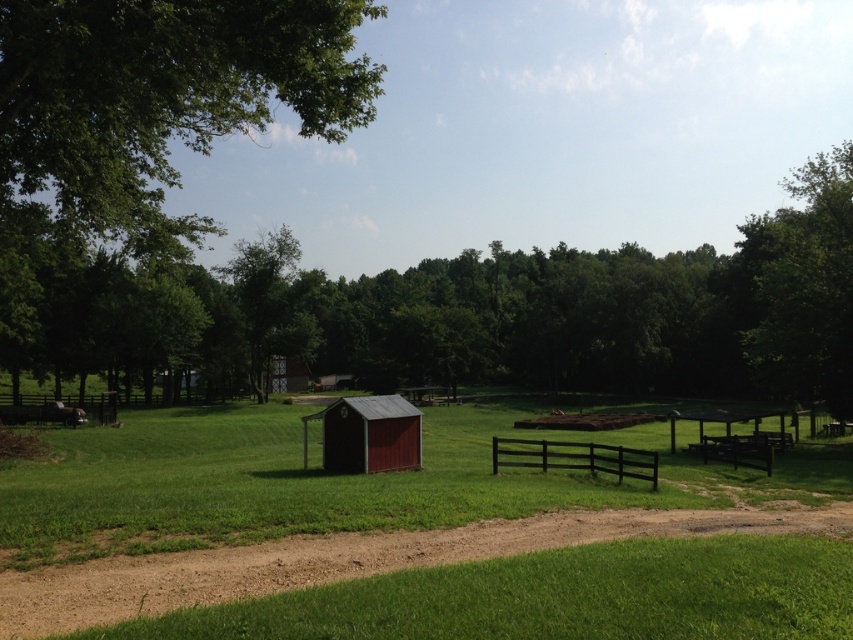
You are a drone operator trying to capture a photo of the black wooden fence at center. You notice the green leafy tree at upper left might block your view. Based on the scene, will the tree obstruct the fence in your photo?

The green leafy tree at upper left is above the black wooden fence at center, so it will block the view of the fence in your photo.

Consider the image. You are a landscape designer planning to add a new garden feature. You see the green leafy tree at upper left and the black wooden fence at center. Which object is bigger in size?

The green leafy tree at upper left is larger in size compared to the black wooden fence at center.

You are a farmer standing at the edge of the dirt track at lower center. You want to walk to the black wooden fence at center. Which direction should you move to reach the fence?

The dirt track at lower center is in front of the black wooden fence at center, so you should move backward to reach the fence.